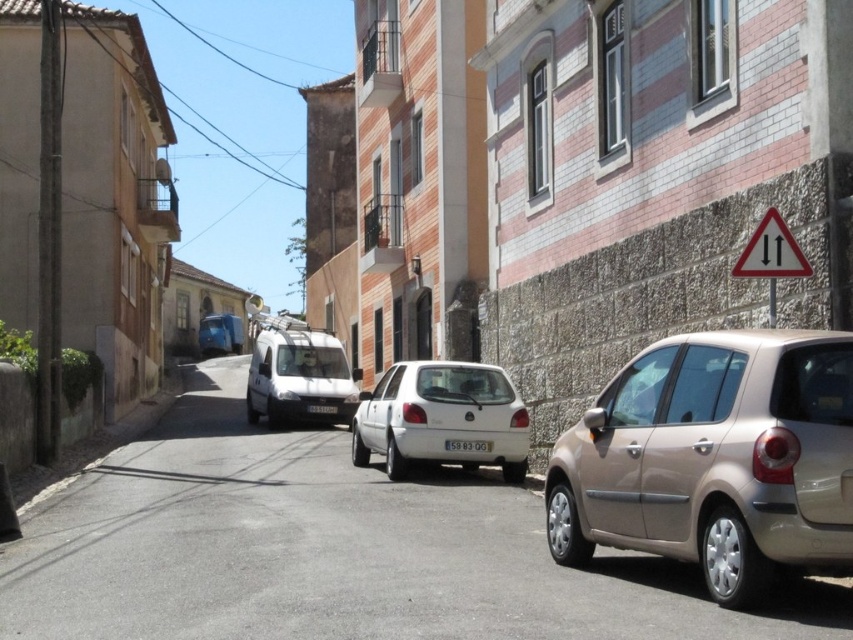
Who is positioned more to the left, white matte hatchback at center or yellow matte license plate at center?

yellow matte license plate at center is more to the left.

Measure the distance between point [397,404] and camera.

The distance of point [397,404] from camera is 40.85 feet.

Does point (410, 438) come in front of point (329, 412)?

Yes.

Identify the location of white matte hatchback at center. pos(440,417).

Does gold metallic hatchback at right come behind white triangular sign at upper right?

No, it is in front of white triangular sign at upper right.

Between point (780, 362) and point (733, 273), which one is positioned behind?

The point (733, 273) is behind.

The width and height of the screenshot is (853, 640). I want to click on gold metallic hatchback at right, so pyautogui.click(x=715, y=460).

Based on the photo, is white matte van at center to the right of metallic blue van at center from the viewer's perspective?

Indeed, white matte van at center is positioned on the right side of metallic blue van at center.

Which is in front, point (326, 385) or point (236, 323)?

Positioned in front is point (326, 385).

The width and height of the screenshot is (853, 640). In order to click on white matte van at center in this screenshot , I will do `click(299, 374)`.